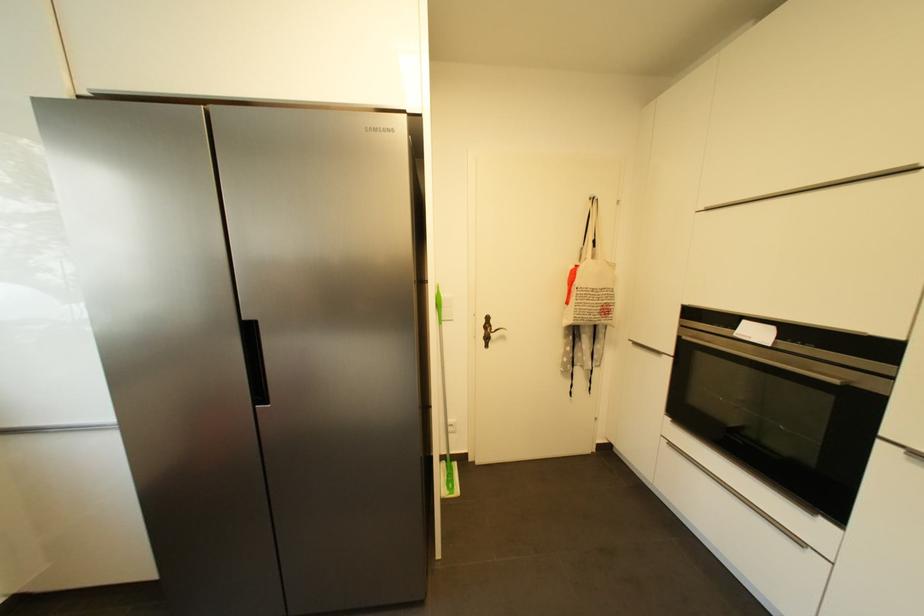
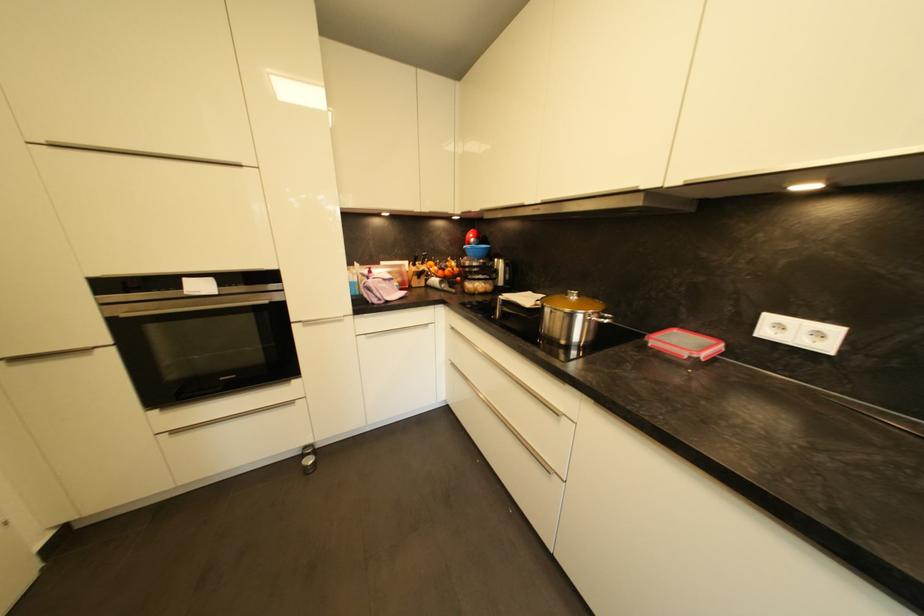
Based on the continuous images, in which direction is the camera rotating?

The camera's rotation is toward right-down.